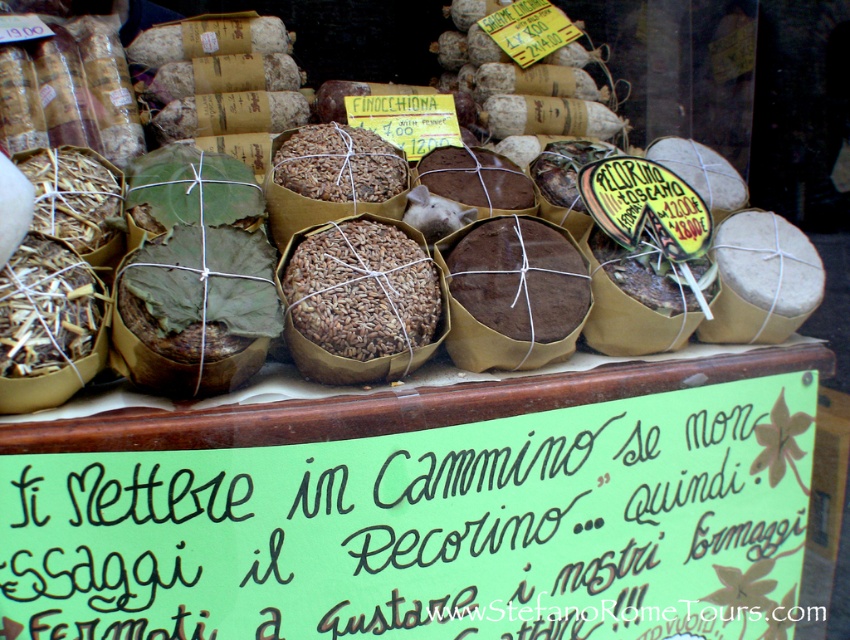
Does green paper sign at lower center appear on the left side of brown textured grain at center?

No, green paper sign at lower center is not to the left of brown textured grain at center.

Does green paper sign at lower center have a lesser height compared to brown textured grain at center?

No, green paper sign at lower center is not shorter than brown textured grain at center.

What are the coordinates of `green paper sign at lower center` in the screenshot? It's located at (429, 529).

Where is `green paper sign at lower center`? green paper sign at lower center is located at coordinates (429, 529).

At what (x,y) coordinates should I click in order to perform the action: click on green paper sign at lower center. Please return your answer as a coordinate pair (x, y). This screenshot has height=640, width=850. Looking at the image, I should click on (429, 529).

Is point (741, 454) less distant than point (570, 13)?

Yes, point (741, 454) is closer to viewer.

You are a GUI agent. You are given a task and a screenshot of the screen. Output one action in this format:
    pyautogui.click(x=<x>, y=<y>)
    Task: Click on the green paper sign at lower center
    Image resolution: width=850 pixels, height=640 pixels.
    Given the screenshot: What is the action you would take?
    pyautogui.click(x=429, y=529)

Between brown paper wrapped cheese at center and brown textured bread at center, which one has more height?

With more height is brown paper wrapped cheese at center.

Who is lower down, brown paper wrapped cheese at center or brown textured bread at center?

Positioned lower is brown textured bread at center.

The image size is (850, 640). What do you see at coordinates (743, 92) in the screenshot?
I see `brown paper wrapped cheese at center` at bounding box center [743, 92].

Where is `brown paper wrapped cheese at center`? The width and height of the screenshot is (850, 640). brown paper wrapped cheese at center is located at coordinates (743, 92).